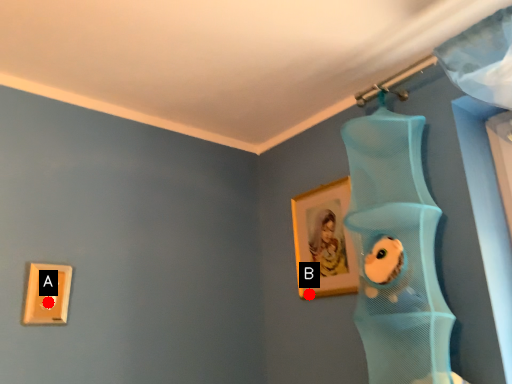
Question: Two points are circled on the image, labeled by A and B beside each circle. Which point is closer to the camera taking this photo?

Choices:
 (A) A is closer
 (B) B is closer

Answer: (A)